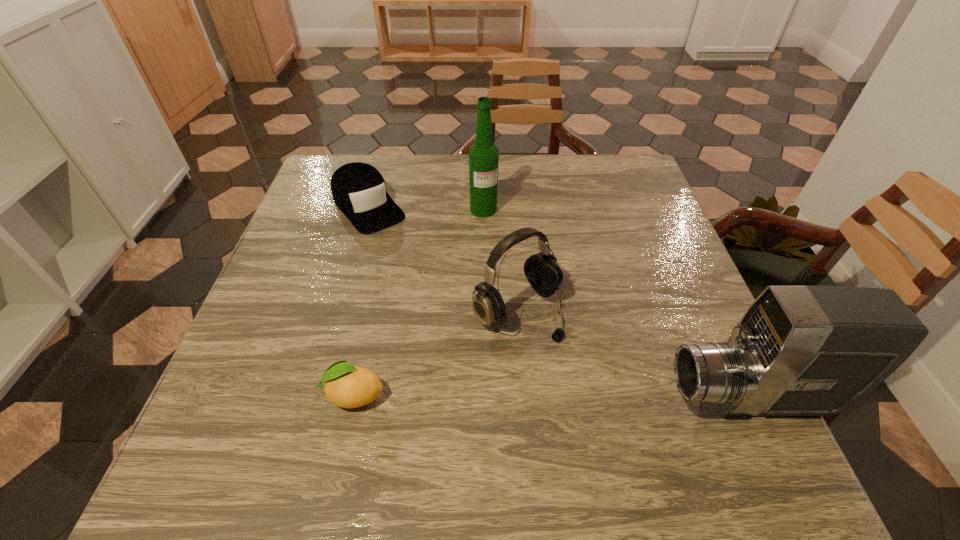
Locate an element on the screen. The image size is (960, 540). vacant space located 0.080m with the microphone on the side of the headset is located at coordinates (576, 366).

This screenshot has width=960, height=540. I want to click on object that is at the far edge, so click(x=358, y=189).

You are a GUI agent. You are given a task and a screenshot of the screen. Output one action in this format:
    pyautogui.click(x=<x>, y=<y>)
    Task: Click on the lemon that is at the near edge
    
    Given the screenshot: What is the action you would take?
    pyautogui.click(x=347, y=386)

The height and width of the screenshot is (540, 960). I want to click on camcorder that is positioned at the near edge, so click(x=798, y=350).

Find the location of a particular element. This screenshot has height=540, width=960. object present at the left edge is located at coordinates (358, 189).

Identify the location of object located at the right edge. This screenshot has height=540, width=960. (798, 350).

Identify the location of object that is at the far left corner. (358, 189).

The height and width of the screenshot is (540, 960). Find the location of `object located at the near right corner`. object located at the near right corner is located at coordinates (798, 350).

Where is `vacant space at the far edge of the desktop`? Image resolution: width=960 pixels, height=540 pixels. vacant space at the far edge of the desktop is located at coordinates (408, 172).

At what (x,y) coordinates should I click in order to perform the action: click on vacant space at the near edge of the desktop. Please return your answer as a coordinate pair (x, y). This screenshot has width=960, height=540. Looking at the image, I should click on (626, 418).